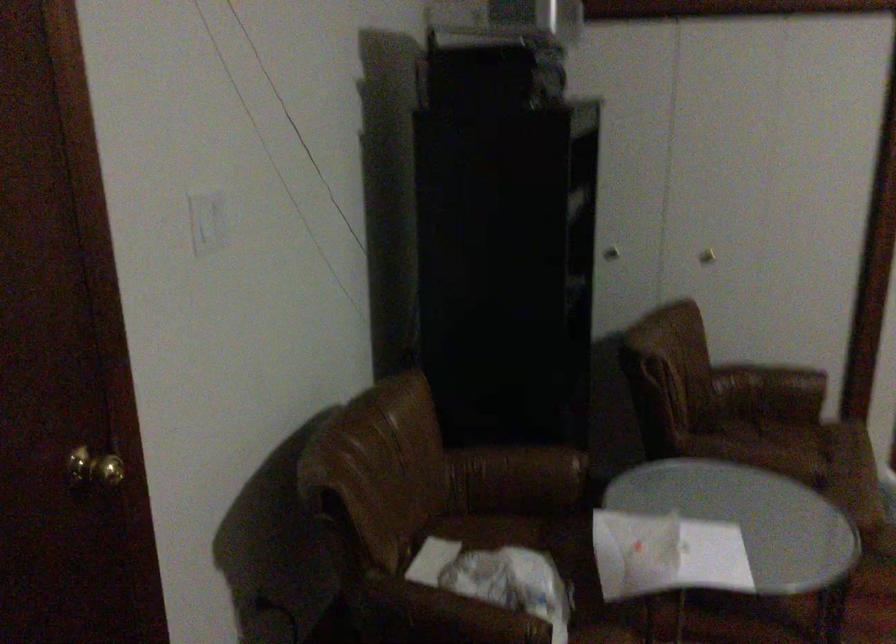
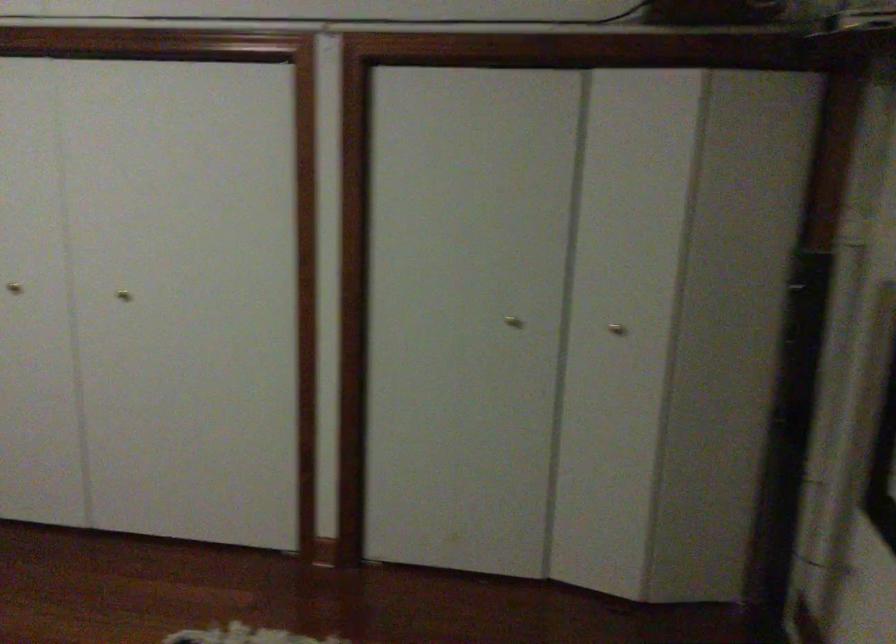
Question: In a continuous first-person perspective shot, in which direction is the camera moving?

Choices:
 (A) Left
 (B) Right
 (C) Forward
 (D) Backward

Answer: (B)